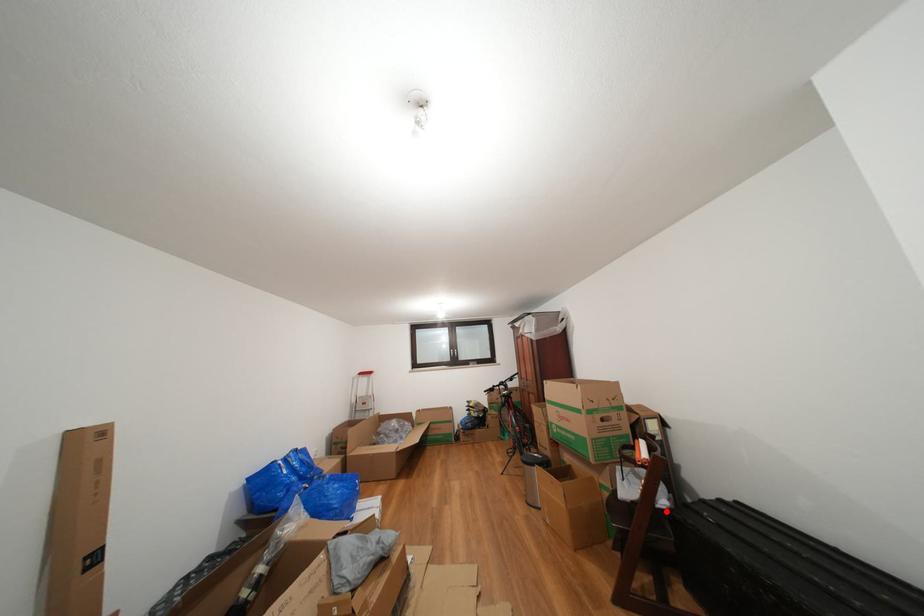
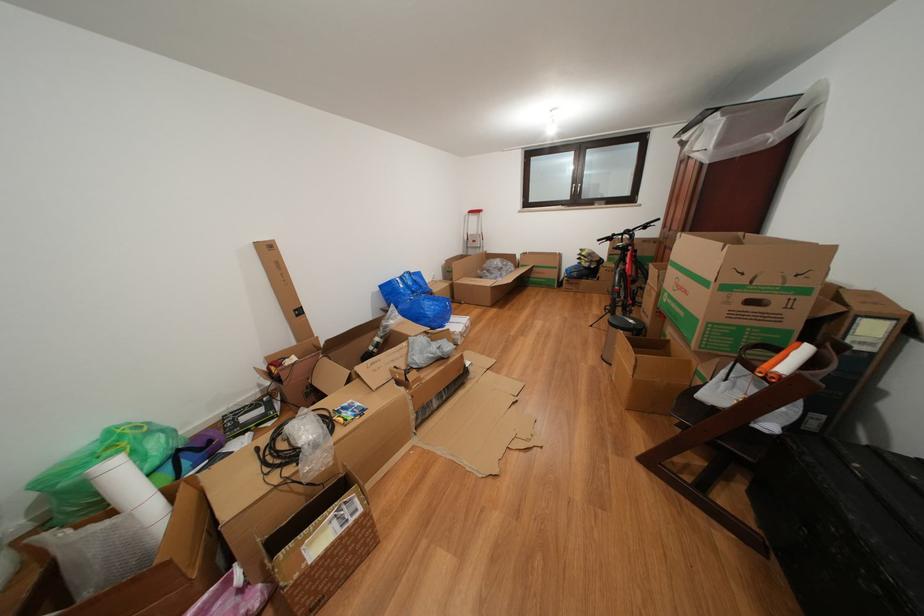
Where in the second image is the point corresponding to the highlighted location from the first image?

(763, 431)